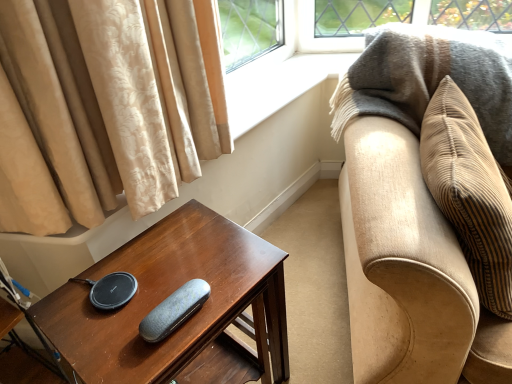
Question: From the image's perspective, does beige corduroy couch at right appear lower than beige corduroy pillow at right?

Choices:
 (A) no
 (B) yes

Answer: (B)

Question: Is beige corduroy couch at right at the left side of beige corduroy pillow at right?

Choices:
 (A) yes
 (B) no

Answer: (B)

Question: From a real-world perspective, is beige corduroy couch at right beneath beige corduroy pillow at right?

Choices:
 (A) no
 (B) yes

Answer: (B)

Question: Is beige corduroy couch at right in front of beige corduroy pillow at right?

Choices:
 (A) no
 (B) yes

Answer: (B)

Question: Is beige corduroy couch at right aimed at beige corduroy pillow at right?

Choices:
 (A) yes
 (B) no

Answer: (A)

Question: From the image's perspective, is dark brown wood table at lower left located above or below textured gray case at center?

Choices:
 (A) below
 (B) above

Answer: (A)

Question: Is point (193, 226) positioned closer to the camera than point (160, 322)?

Choices:
 (A) farther
 (B) closer

Answer: (A)

Question: Considering the positions of dark brown wood table at lower left and textured gray case at center in the image, is dark brown wood table at lower left taller or shorter than textured gray case at center?

Choices:
 (A) tall
 (B) short

Answer: (A)

Question: In terms of width, does dark brown wood table at lower left look wider or thinner when compared to textured gray case at center?

Choices:
 (A) thin
 (B) wide

Answer: (B)

Question: In terms of width, does textured gray case at center look wider or thinner when compared to dark brown wood table at lower left?

Choices:
 (A) thin
 (B) wide

Answer: (A)

Question: Is textured gray case at center taller or shorter than dark brown wood table at lower left?

Choices:
 (A) short
 (B) tall

Answer: (A)

Question: Based on their sizes in the image, would you say textured gray case at center is bigger or smaller than dark brown wood table at lower left?

Choices:
 (A) small
 (B) big

Answer: (A)

Question: Is textured gray case at center situated inside dark brown wood table at lower left or outside?

Choices:
 (A) inside
 (B) outside

Answer: (A)

Question: Is dark brown wood table at lower left inside or outside of beige corduroy couch at right?

Choices:
 (A) inside
 (B) outside

Answer: (B)

Question: From a real-world perspective, relative to beige corduroy couch at right, is dark brown wood table at lower left vertically above or below?

Choices:
 (A) above
 (B) below

Answer: (B)